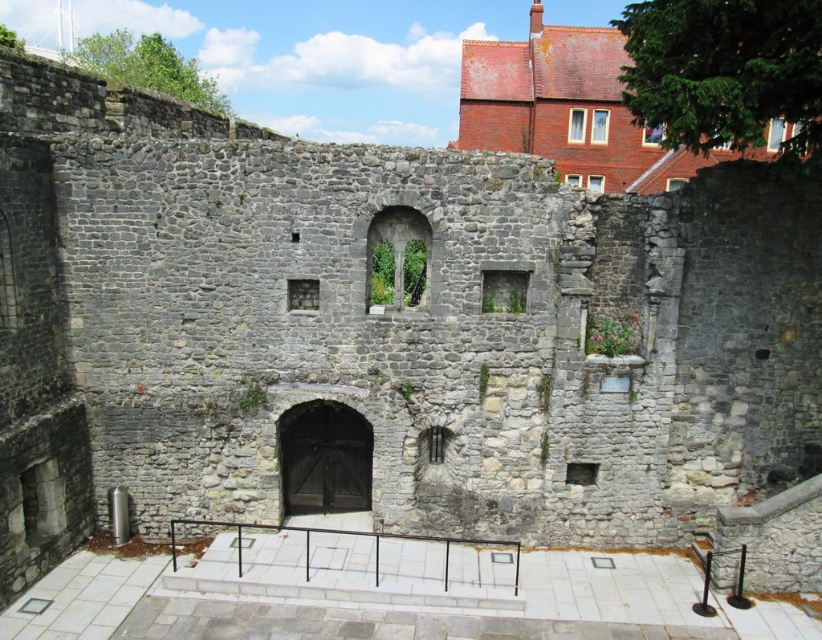
Question: Which point is closer to the camera taking this photo?

Choices:
 (A) pos(375,579)
 (B) pos(294,497)

Answer: (A)

Question: Which of the following is the closest to the observer?

Choices:
 (A) dark wood door at center
 (B) black metal rail at center

Answer: (B)

Question: Among these objects, which one is farthest from the camera?

Choices:
 (A) black metal rail at center
 (B) dark wood door at center

Answer: (B)

Question: Can you confirm if dark wood door at center is wider than black metal rail at center?

Choices:
 (A) yes
 (B) no

Answer: (B)

Question: Does dark wood door at center have a lesser width compared to black metal rail at center?

Choices:
 (A) no
 (B) yes

Answer: (B)

Question: Is dark wood door at center thinner than black metal rail at center?

Choices:
 (A) yes
 (B) no

Answer: (A)